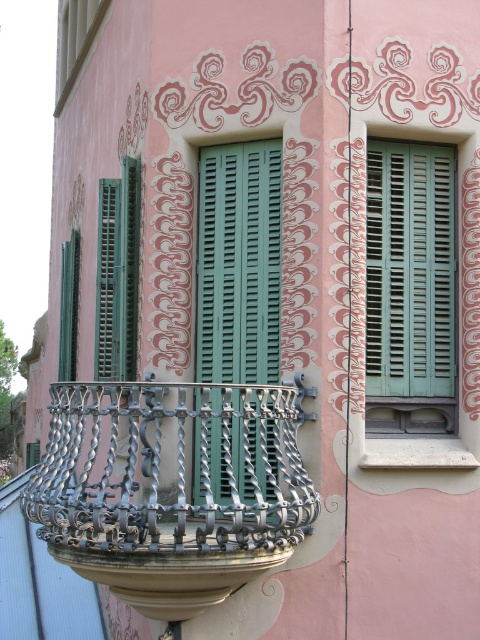
Question: Which point appears closest to the camera in this image?

Choices:
 (A) (439, 376)
 (B) (269, 355)

Answer: (B)

Question: Which of the following is the farthest from the observer?

Choices:
 (A) teal wooden shutters at center
 (B) green matte shutters at center
 (C) polished metal balcony at center

Answer: (A)

Question: Does green matte shutters at center appear over teal wooden shutters at center?

Choices:
 (A) no
 (B) yes

Answer: (A)

Question: Is green matte shutters at center positioned in front of teal wooden shutters at center?

Choices:
 (A) yes
 (B) no

Answer: (A)

Question: Which object appears farthest from the camera in this image?

Choices:
 (A) polished metal balcony at center
 (B) green matte shutters at center

Answer: (B)

Question: Does green matte shutters at center come in front of teal wooden shutters at center?

Choices:
 (A) yes
 (B) no

Answer: (A)